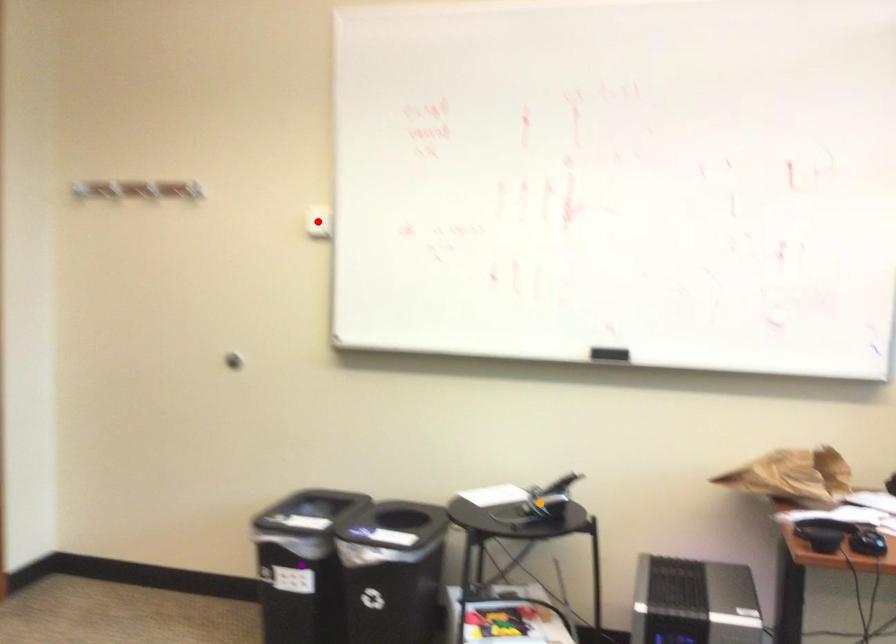
Order these from nearest to farthest:
- red point
- orange point
- purple point

red point → purple point → orange point